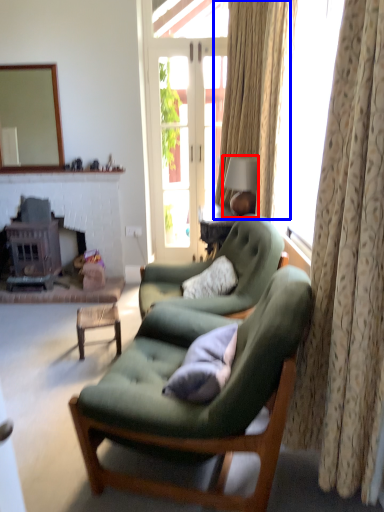
Question: Which object is closer to the camera taking this photo, lamp (highlighted by a red box) or curtain (highlighted by a blue box)?

Choices:
 (A) lamp
 (B) curtain

Answer: (A)